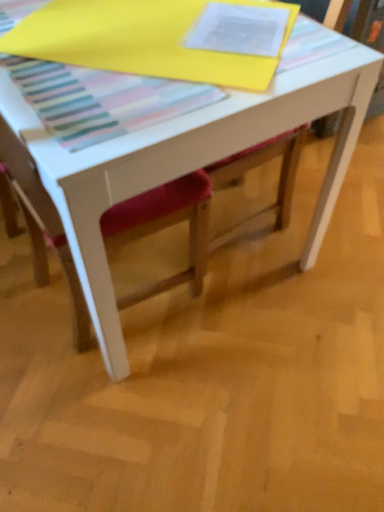
Locate an element on the screen. free space in front of velvet red chair at center is located at coordinates (107, 418).